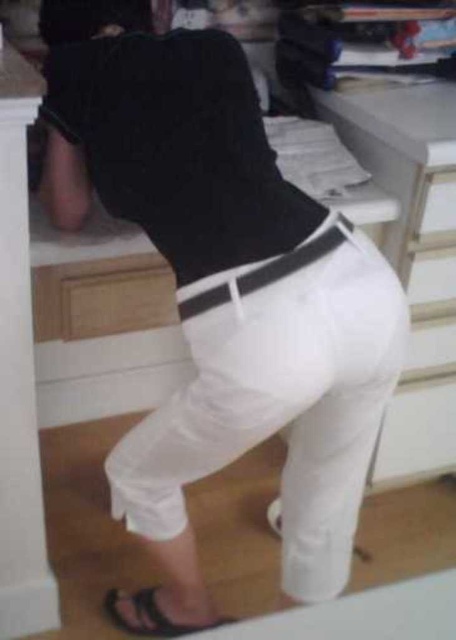
Question: From the image, what is the correct spatial relationship of black leather sandal at lower center in relation to white matte drawer at center?

Choices:
 (A) left
 (B) right

Answer: (A)

Question: Is black leather sandal at lower center bigger than white matte drawer at center?

Choices:
 (A) no
 (B) yes

Answer: (B)

Question: Among these points, which one is farthest from the camera?

Choices:
 (A) (439, 184)
 (B) (146, 602)

Answer: (B)

Question: Can you confirm if black leather sandal at lower center is smaller than white matte drawer at center?

Choices:
 (A) yes
 (B) no

Answer: (B)

Question: Among these objects, which one is farthest from the camera?

Choices:
 (A) white matte drawer at center
 (B) black leather sandal at lower center

Answer: (B)

Question: Which object is closer to the camera taking this photo?

Choices:
 (A) white matte drawer at center
 (B) black leather sandal at lower center

Answer: (A)